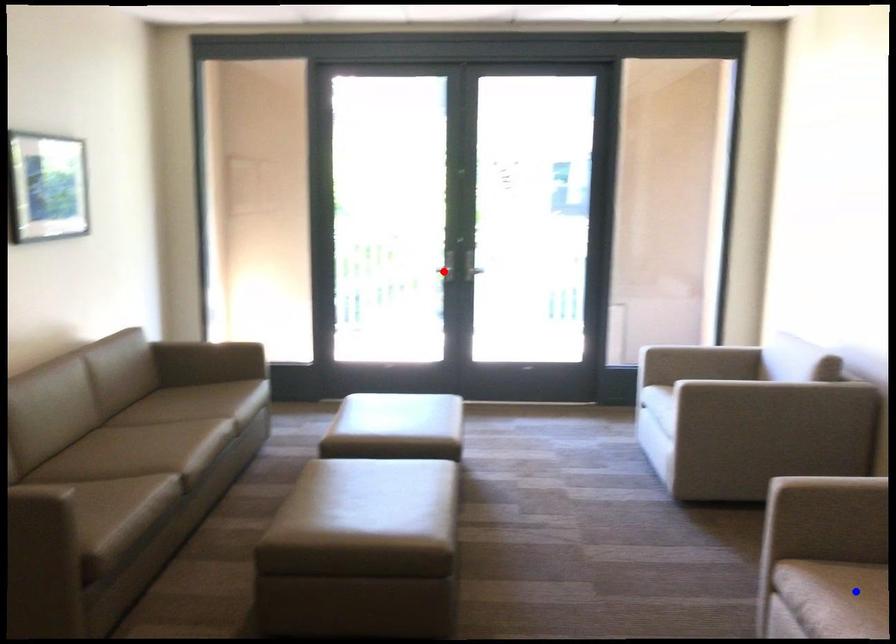
Question: In the image, two points are highlighted. Which point is nearer to the camera? Reply with the corresponding letter.

Choices:
 (A) blue point
 (B) red point

Answer: (A)